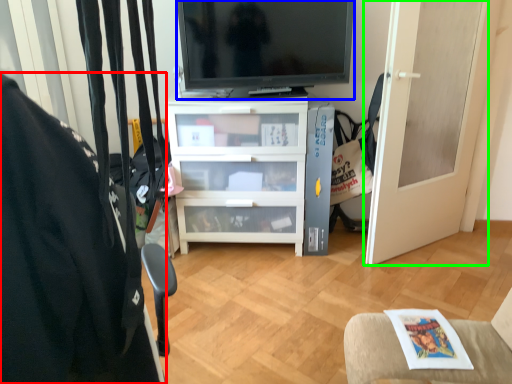
Question: Which object is positioned closest to furniture (highlighted by a red box)? Select from television (highlighted by a blue box) and door (highlighted by a green box).

Choices:
 (A) television
 (B) door

Answer: (A)